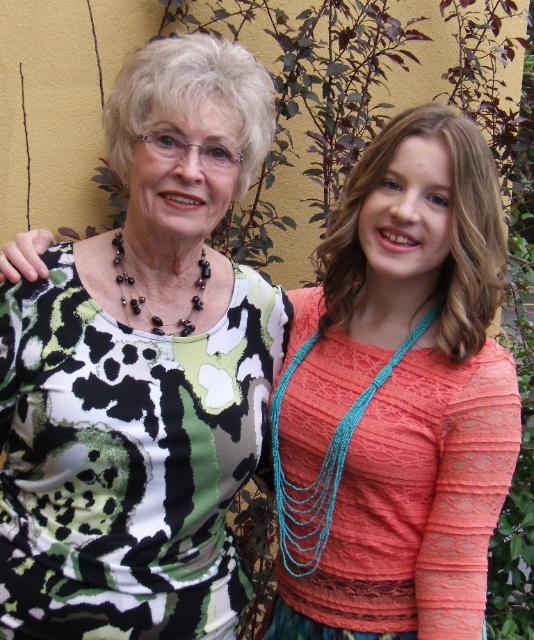
You are taking a photo of two people standing against a yellow wall with greenery. You notice two points marked in the image at coordinates point (421, 236) and point (153, 570). If you want to focus on the closer point to ensure the photo is sharp, which coordinate should you select?

Point (153, 570) is closer to the camera than point (421, 236), so you should select point (153, 570) to focus on for a sharp photo.